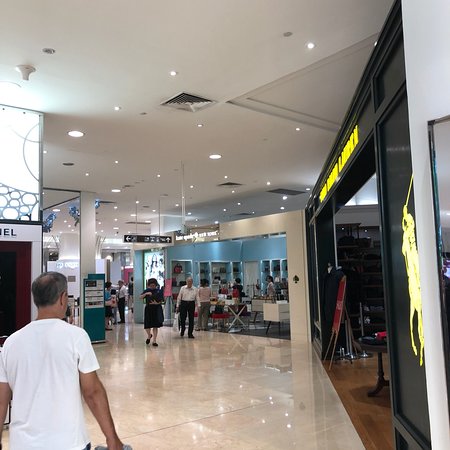
I want to click on light source, so click(x=214, y=153), click(x=117, y=189), click(x=115, y=206).